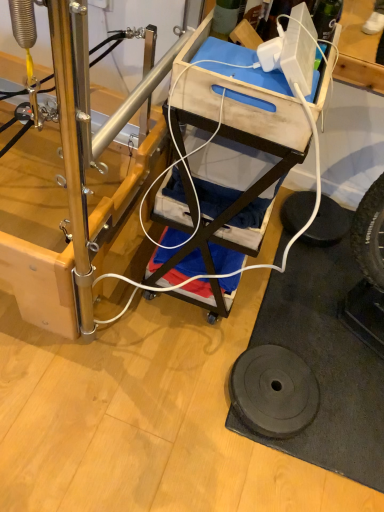
Question: Considering the relative sizes of black rubber tire at lower right and wooden cart at center in the image provided, is black rubber tire at lower right bigger than wooden cart at center?

Choices:
 (A) yes
 (B) no

Answer: (B)

Question: From a real-world perspective, is black rubber tire at lower right positioned under wooden cart at center based on gravity?

Choices:
 (A) yes
 (B) no

Answer: (A)

Question: Is black rubber tire at lower right facing towards wooden cart at center?

Choices:
 (A) yes
 (B) no

Answer: (B)

Question: Is black rubber tire at lower right positioned behind wooden cart at center?

Choices:
 (A) no
 (B) yes

Answer: (B)

Question: Is black rubber tire at lower right to the left of wooden cart at center from the viewer's perspective?

Choices:
 (A) no
 (B) yes

Answer: (A)

Question: Would you say black rubber tire at lower right contains wooden cart at center?

Choices:
 (A) yes
 (B) no

Answer: (B)

Question: Is black rubber tire at lower right surrounded by black rubber weight at lower right?

Choices:
 (A) no
 (B) yes

Answer: (A)

Question: Is black rubber weight at lower right to the left of black rubber tire at lower right from the viewer's perspective?

Choices:
 (A) yes
 (B) no

Answer: (A)

Question: Can you confirm if black rubber weight at lower right is taller than black rubber tire at lower right?

Choices:
 (A) yes
 (B) no

Answer: (A)

Question: Is black rubber weight at lower right at the right side of black rubber tire at lower right?

Choices:
 (A) no
 (B) yes

Answer: (A)

Question: From a real-world perspective, is black rubber weight at lower right physically above black rubber tire at lower right?

Choices:
 (A) no
 (B) yes

Answer: (B)

Question: Does black rubber weight at lower right come in front of black rubber tire at lower right?

Choices:
 (A) yes
 (B) no

Answer: (A)

Question: Are black rubber weight at lower right and wooden cart at center located far from each other?

Choices:
 (A) yes
 (B) no

Answer: (B)